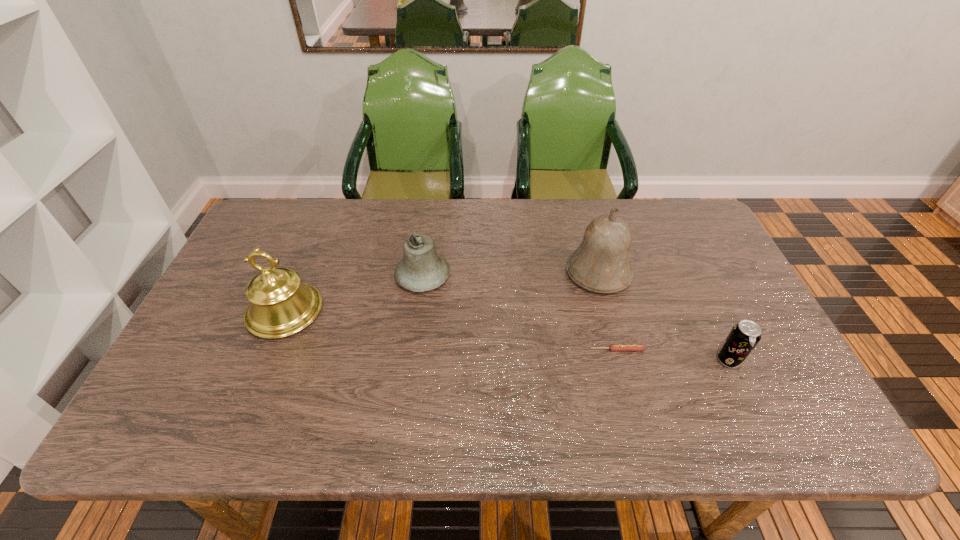
Identify the location of vacant space that is in between the sausage and the rightmost bell. (608, 312).

Find the location of a particular element. The height and width of the screenshot is (540, 960). object that is the second nearest to the sausage is located at coordinates (601, 264).

At what (x,y) coordinates should I click in order to perform the action: click on object that stands as the third closest to the shortest object. Please return your answer as a coordinate pair (x, y). The image size is (960, 540). Looking at the image, I should click on (421, 269).

Locate an element on the screen. bell that stands as the closest to the leftmost object is located at coordinates (421, 269).

Identify the location of bell that is the second closest to the rightmost bell. point(280,305).

Where is `vacant space that satisfies the following two spatial constraints: 1. on the back side of the second object from left to right; 2. on the left side of the leftmost object`? vacant space that satisfies the following two spatial constraints: 1. on the back side of the second object from left to right; 2. on the left side of the leftmost object is located at coordinates (300, 276).

The width and height of the screenshot is (960, 540). I want to click on vacant space that satisfies the following two spatial constraints: 1. on the back side of the shortest object; 2. on the left side of the rightmost bell, so click(597, 273).

Locate an element on the screen. The image size is (960, 540). vacant region that satisfies the following two spatial constraints: 1. on the back side of the rightmost bell; 2. on the right side of the shortest object is located at coordinates (597, 273).

What are the coordinates of `vacant point that satisfies the following two spatial constraints: 1. on the back side of the third tallest object; 2. on the left side of the rightmost bell` in the screenshot? It's located at (423, 273).

Image resolution: width=960 pixels, height=540 pixels. Find the location of `free point that satisfies the following two spatial constraints: 1. on the front side of the sausage; 2. on the left side of the leftmost object`. free point that satisfies the following two spatial constraints: 1. on the front side of the sausage; 2. on the left side of the leftmost object is located at coordinates (270, 350).